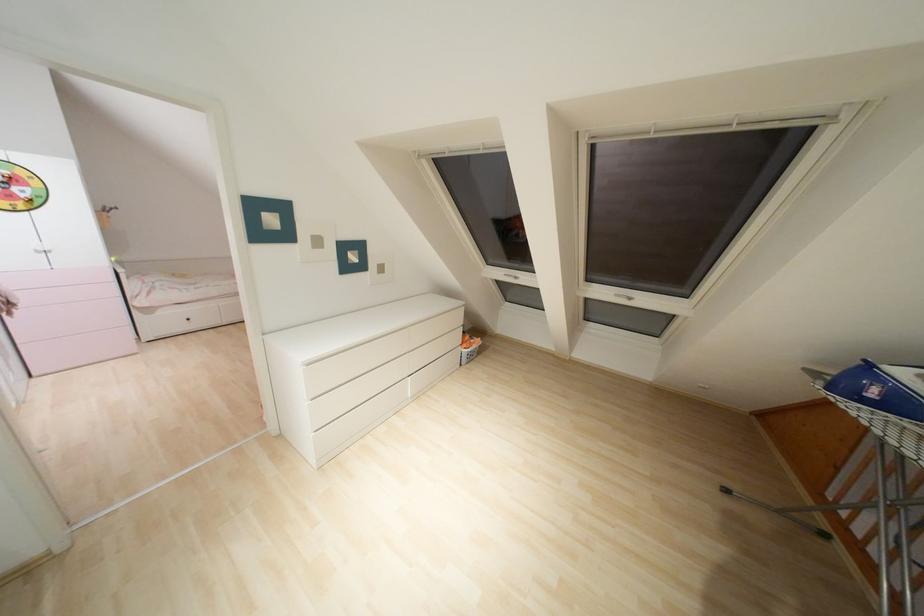
The height and width of the screenshot is (616, 924). In order to click on black drawer knob in this screenshot , I will do `click(188, 318)`.